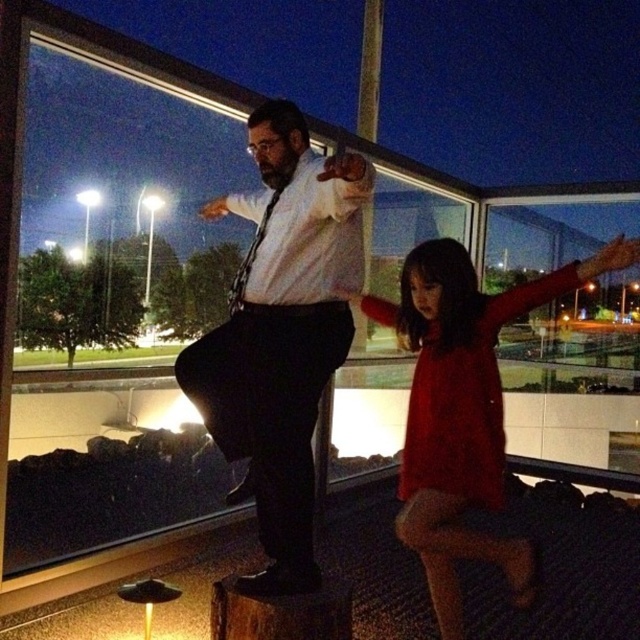
You are a photographer standing in the corner of the room. You need to capture a photo that includes both the matte white shirt at center and the matte red dress at center. Which object should you focus on first to ensure both are in frame?

The matte white shirt at center is much taller than the matte red dress at center, so you should focus on the matte white shirt at center first to ensure both are in frame.

You are a photographer standing in front of the building. You want to take a picture of the matte white shirt at center and the matte red dress at center so that both are clearly visible. Based on their positions, which one should you focus on first to ensure both are in frame?

The matte white shirt at center is positioned on the left side of the matte red dress at center. To ensure both are in frame, focus on the matte white shirt at center first as it is on the left, then adjust to include the matte red dress at center on the right.